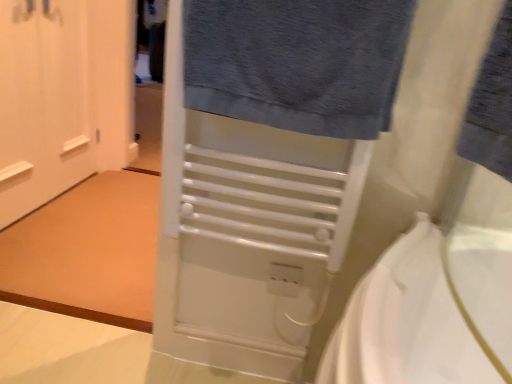
At what (x,y) coordinates should I click in order to perform the action: click on vacant space in front of white matte door at left. Please return your answer as a coordinate pair (x, y). The height and width of the screenshot is (384, 512). Looking at the image, I should click on (66, 244).